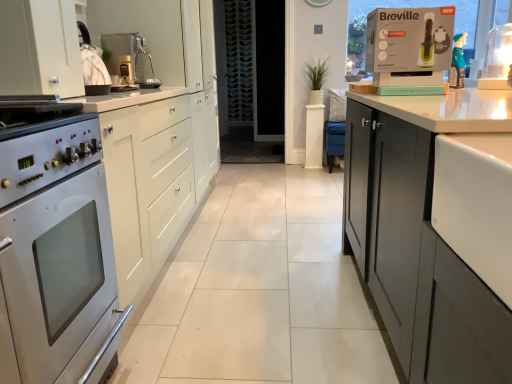
Question: Is white matte cabinet at left smaller than matte white box at upper right?

Choices:
 (A) no
 (B) yes

Answer: (A)

Question: Is white matte cabinet at left at the right side of matte white box at upper right?

Choices:
 (A) no
 (B) yes

Answer: (A)

Question: Is white matte cabinet at left facing away from matte white box at upper right?

Choices:
 (A) yes
 (B) no

Answer: (B)

Question: From a real-world perspective, does white matte cabinet at left sit lower than matte white box at upper right?

Choices:
 (A) no
 (B) yes

Answer: (B)

Question: From a real-world perspective, is white matte cabinet at left positioned over matte white box at upper right based on gravity?

Choices:
 (A) yes
 (B) no

Answer: (B)

Question: Can you confirm if white matte cabinet at left is shorter than matte white box at upper right?

Choices:
 (A) no
 (B) yes

Answer: (A)

Question: Does metallic silver coffee machine at upper center appear on the right side of white glossy lamp at upper right?

Choices:
 (A) yes
 (B) no

Answer: (B)

Question: Are metallic silver coffee machine at upper center and white glossy lamp at upper right located far from each other?

Choices:
 (A) yes
 (B) no

Answer: (A)

Question: Is metallic silver coffee machine at upper center in front of white glossy lamp at upper right?

Choices:
 (A) no
 (B) yes

Answer: (A)

Question: From a real-world perspective, is metallic silver coffee machine at upper center on white glossy lamp at upper right?

Choices:
 (A) yes
 (B) no

Answer: (A)

Question: Can you confirm if metallic silver coffee machine at upper center is thinner than white glossy lamp at upper right?

Choices:
 (A) no
 (B) yes

Answer: (A)

Question: Is metallic silver coffee machine at upper center facing away from white glossy lamp at upper right?

Choices:
 (A) no
 (B) yes

Answer: (A)

Question: From a real-world perspective, is metallic silver coffee machine at upper center positioned under matte white box at upper right based on gravity?

Choices:
 (A) no
 (B) yes

Answer: (B)